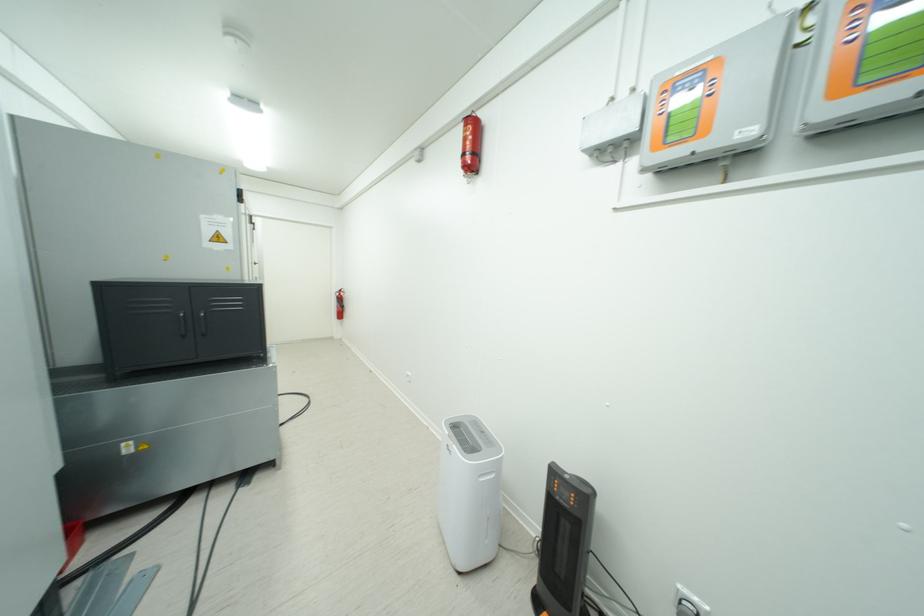
The width and height of the screenshot is (924, 616). Identify the location of black space heater. (564, 544).